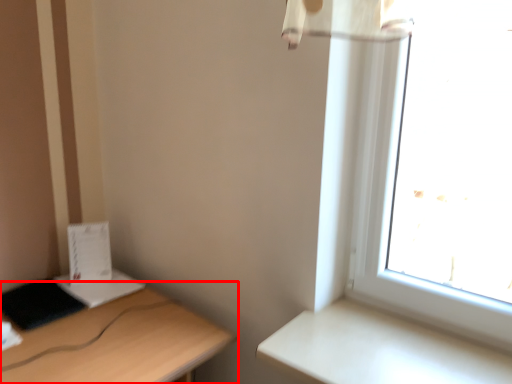
Question: In this image, where is desk (annotated by the red box) located relative to table?

Choices:
 (A) left
 (B) right

Answer: (A)